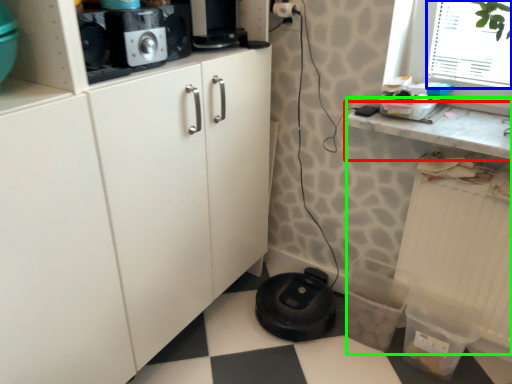
Question: Which object is the closest to the countertop (highlighted by a red box)? Choose among these: window screen (highlighted by a blue box) or counter (highlighted by a green box).

Choices:
 (A) window screen
 (B) counter

Answer: (B)